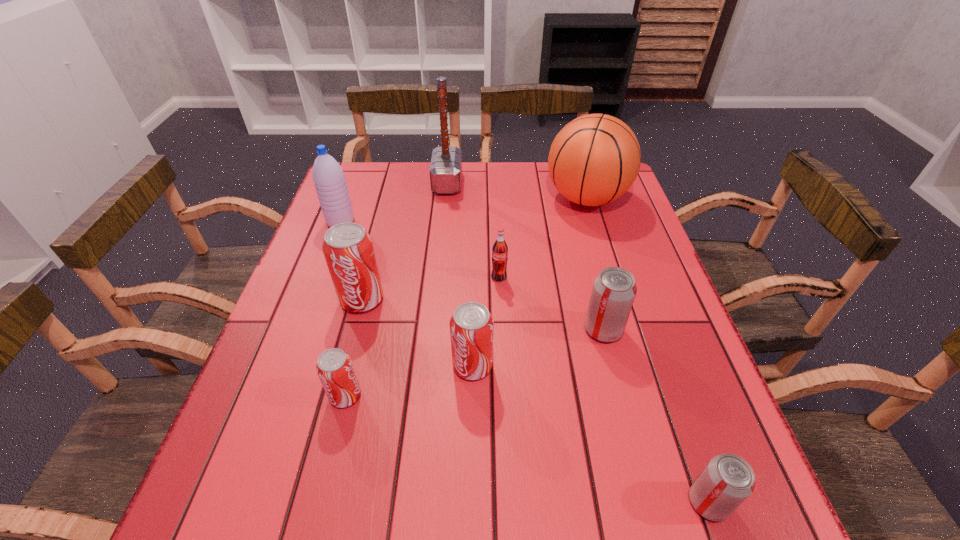
Locate an element on the screen. The image size is (960, 540). the fifth object from right to left is located at coordinates (471, 326).

This screenshot has width=960, height=540. In order to click on the fourth farthest object in this screenshot , I will do `click(500, 249)`.

At what (x,y) coordinates should I click in order to perform the action: click on the sixth object from left to right. Please return your answer as a coordinate pair (x, y). This screenshot has width=960, height=540. Looking at the image, I should click on (500, 249).

Where is `the smallest red soda can`? the smallest red soda can is located at coordinates (335, 370).

Where is `the smaller gray soda can`? Image resolution: width=960 pixels, height=540 pixels. the smaller gray soda can is located at coordinates (728, 480).

This screenshot has width=960, height=540. Identify the location of the nearer gray soda can. (728, 480).

Where is `vacant space situated on the striking surface of the tallest object`? The width and height of the screenshot is (960, 540). vacant space situated on the striking surface of the tallest object is located at coordinates (560, 183).

Find the location of a particular element. The height and width of the screenshot is (540, 960). free space located 0.210m on the front of the basketball is located at coordinates (610, 276).

Identify the location of vacant space located on the front of the blue water bottle. Image resolution: width=960 pixels, height=540 pixels. (324, 267).

Find the location of a particular element. The image size is (960, 540). free location located 0.110m on the logo side of the farthest red soda can is located at coordinates (347, 356).